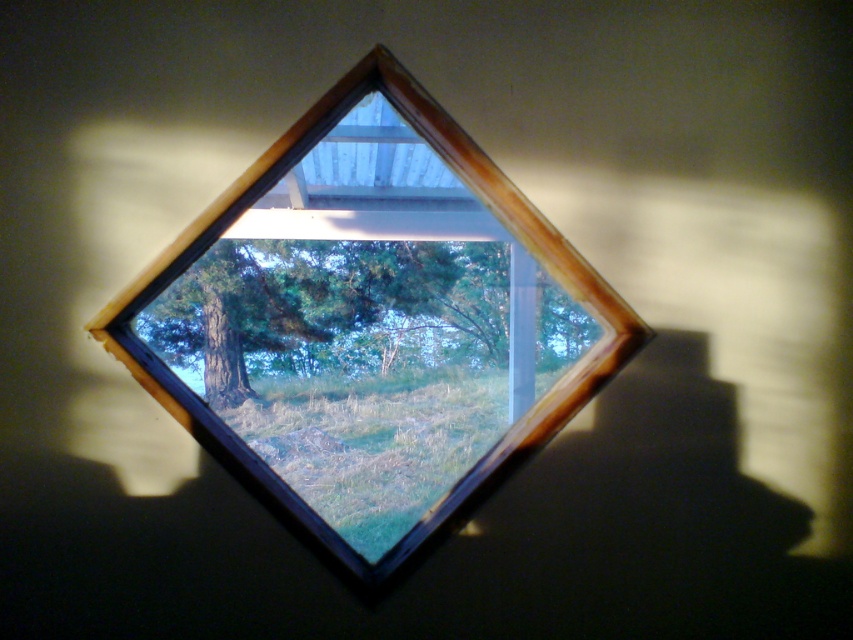
Question: Which point is farther from the camera taking this photo?

Choices:
 (A) (461, 284)
 (B) (181, 362)

Answer: (B)

Question: Considering the relative positions of wooden window frame at center and green matte tree at center in the image provided, where is wooden window frame at center located with respect to green matte tree at center?

Choices:
 (A) right
 (B) left

Answer: (A)

Question: Does wooden window frame at center have a lesser width compared to green matte tree at center?

Choices:
 (A) no
 (B) yes

Answer: (B)

Question: Can you confirm if wooden window frame at center is wider than green matte tree at center?

Choices:
 (A) no
 (B) yes

Answer: (A)